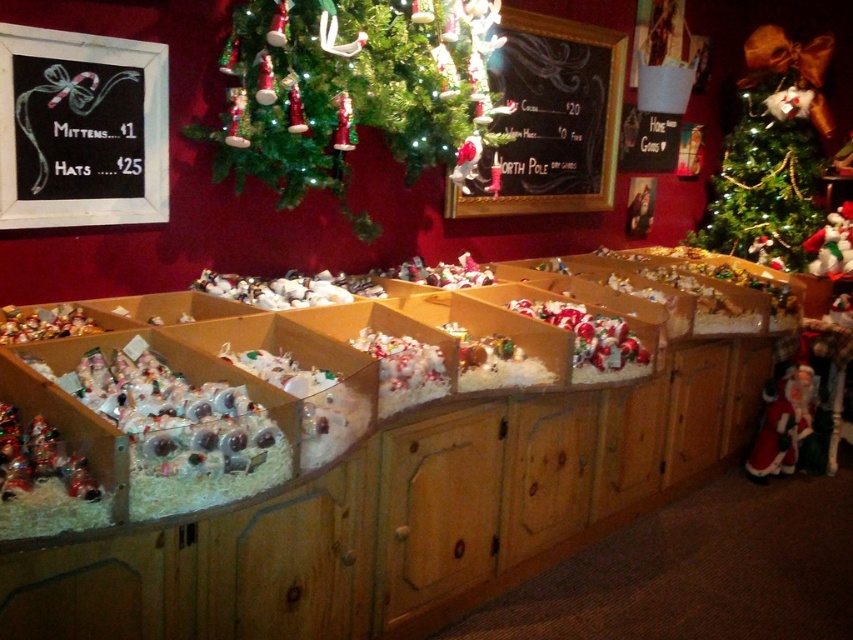
Is green textured christmas tree at upper right behind velvet santa at right?

Yes, green textured christmas tree at upper right is further from the viewer.

Between green textured christmas tree at upper right and velvet santa at right, which one has more height?

green textured christmas tree at upper right is taller.

Who is more distant from viewer, [747,154] or [753,442]?

Positioned behind is point [747,154].

This screenshot has height=640, width=853. Find the location of `green textured christmas tree at upper right`. green textured christmas tree at upper right is located at coordinates (767, 177).

Which is below, green matte christmas tree at upper center or velvet santa at right?

velvet santa at right is below.

What do you see at coordinates (352, 90) in the screenshot? I see `green matte christmas tree at upper center` at bounding box center [352, 90].

Identify the location of green matte christmas tree at upper center. Image resolution: width=853 pixels, height=640 pixels. (352, 90).

Between black chalkboard at upper center and white plush santa at right, which one has more height?

black chalkboard at upper center is taller.

Can you confirm if black chalkboard at upper center is positioned to the left of white plush santa at right?

Yes, black chalkboard at upper center is to the left of white plush santa at right.

Where is `black chalkboard at upper center`? black chalkboard at upper center is located at coordinates (549, 120).